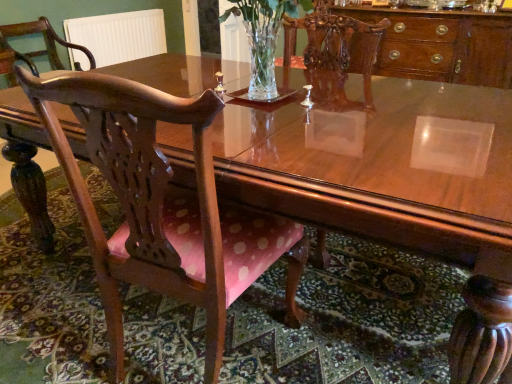
This screenshot has width=512, height=384. I want to click on wooden chair with pink cushion at center, which is the first chair from bottom to top, so click(162, 206).

This screenshot has height=384, width=512. What do you see at coordinates (41, 50) in the screenshot?
I see `polished wood chair at left, positioned as the first chair in top-to-bottom order` at bounding box center [41, 50].

In order to face polished wood cabinet at upper right, should I rotate leftwards or rightwards?

To face it directly, rotate right by 21.017 degrees.

The height and width of the screenshot is (384, 512). Find the location of `wooden chair with pink cushion at center, which is the second chair from left to right`. wooden chair with pink cushion at center, which is the second chair from left to right is located at coordinates (162, 206).

Which of these two, white ribbed radiator at upper left or clear glass vase at center, stands shorter?

Standing shorter between the two is clear glass vase at center.

Can we say white ribbed radiator at upper left lies outside clear glass vase at center?

Yes.

Can you tell me how much white ribbed radiator at upper left and clear glass vase at center differ in facing direction?

The facing directions of white ribbed radiator at upper left and clear glass vase at center are 87.4 degrees apart.

Is white ribbed radiator at upper left not near clear glass vase at center?

That's right, there is a large distance between white ribbed radiator at upper left and clear glass vase at center.

From the picture: Can you see polished wood cabinet at upper right touching wooden chair with pink cushion at center, which is counted as the second chair, starting from the back?

No.

From a real-world perspective, which is physically above, polished wood cabinet at upper right or wooden chair with pink cushion at center, which ranks as the first chair in right-to-left order?

polished wood cabinet at upper right.

Relative to wooden chair with pink cushion at center, acting as the 2th chair starting from the top, is polished wood cabinet at upper right in front or behind?

Visually, polished wood cabinet at upper right is located behind wooden chair with pink cushion at center, acting as the 2th chair starting from the top.

Would you say polished wood cabinet at upper right contains wooden chair with pink cushion at center, which ranks as the first chair in right-to-left order?

No, wooden chair with pink cushion at center, which ranks as the first chair in right-to-left order, is not surrounded by polished wood cabinet at upper right.

From a real-world perspective, is polished wood chair at left, arranged as the 2th chair when viewed from the front, located beneath white ribbed radiator at upper left?

No, from a real-world perspective, polished wood chair at left, arranged as the 2th chair when viewed from the front, is not below white ribbed radiator at upper left.

Is polished wood chair at left, which is the 1th chair in left-to-right order, taller or shorter than white ribbed radiator at upper left?

polished wood chair at left, which is the 1th chair in left-to-right order, is taller than white ribbed radiator at upper left.

Considering the positions of objects polished wood chair at left, arranged as the 2th chair when viewed from the front, and white ribbed radiator at upper left in the image provided, who is more to the left, polished wood chair at left, arranged as the 2th chair when viewed from the front, or white ribbed radiator at upper left?

Positioned to the left is polished wood chair at left, arranged as the 2th chair when viewed from the front.

Does point (274, 99) appear closer or farther from the camera than point (7, 30)?

Point (274, 99) is closer to the camera than point (7, 30).

Can you confirm if clear glass vase at center is taller than polished wood chair at left, acting as the first chair starting from the back?

No, clear glass vase at center is not taller than polished wood chair at left, acting as the first chair starting from the back.

Looking at the image, does clear glass vase at center seem bigger or smaller compared to polished wood chair at left, arranged as the 2th chair when viewed from the front?

Considering their sizes, clear glass vase at center takes up less space than polished wood chair at left, arranged as the 2th chair when viewed from the front.

Is clear glass vase at center outside of polished wood chair at left, positioned as the first chair in top-to-bottom order?

Yes, clear glass vase at center is outside of polished wood chair at left, positioned as the first chair in top-to-bottom order.

From a real-world perspective, between wooden chair with pink cushion at center, which is counted as the second chair, starting from the back, and polished wood cabinet at upper right, who is vertically lower?

From a 3D spatial view, wooden chair with pink cushion at center, which is counted as the second chair, starting from the back, is below.

Is polished wood cabinet at upper right located within wooden chair with pink cushion at center, acting as the first chair starting from the front?

No.

Where is `cabinetry above the wooden chair with pink cushion at center, which is the second chair from left to right (from a real-world perspective)`? cabinetry above the wooden chair with pink cushion at center, which is the second chair from left to right (from a real-world perspective) is located at coordinates (442, 45).

Considering their positions, is wooden chair with pink cushion at center, acting as the first chair starting from the front, located in front of or behind polished wood cabinet at upper right?

Visually, wooden chair with pink cushion at center, acting as the first chair starting from the front, is located in front of polished wood cabinet at upper right.

From the image's perspective, which one is positioned higher, white ribbed radiator at upper left or polished wood chair at left, the second chair in the bottom-to-top sequence?

white ribbed radiator at upper left, from the image's perspective.

Is white ribbed radiator at upper left situated inside polished wood chair at left, acting as the first chair starting from the back, or outside?

white ribbed radiator at upper left exists outside the volume of polished wood chair at left, acting as the first chair starting from the back.

From a real-world perspective, which is physically above, white ribbed radiator at upper left or polished wood chair at left, the second chair in the bottom-to-top sequence?

polished wood chair at left, the second chair in the bottom-to-top sequence, is physically above.

Is white ribbed radiator at upper left thinner than polished wood chair at left, arranged as the 2th chair when viewed from the front?

Yes.

Is clear glass vase at center a part of polished wood cabinet at upper right?

No, clear glass vase at center is not inside polished wood cabinet at upper right.

Is polished wood cabinet at upper right positioned in front of clear glass vase at center?

No, it is not.

Does polished wood cabinet at upper right have a greater width compared to clear glass vase at center?

Yes, polished wood cabinet at upper right is wider than clear glass vase at center.

Who is shorter, polished wood cabinet at upper right or clear glass vase at center?

clear glass vase at center.

You are a GUI agent. You are given a task and a screenshot of the screen. Output one action in this format:
    pyautogui.click(x=<x>, y=<y>)
    Task: Click on the radiator on the left side of clear glass vase at center
    The height and width of the screenshot is (384, 512).
    Given the screenshot: What is the action you would take?
    pyautogui.click(x=119, y=35)

I want to click on cabinetry behind the wooden chair with pink cushion at center, which ranks as the first chair in right-to-left order, so click(x=442, y=45).

Looking at the image, which one is located closer to clear glass vase at center, wooden chair with pink cushion at center, which is the first chair from bottom to top, or white ribbed radiator at upper left?

wooden chair with pink cushion at center, which is the first chair from bottom to top.

Looking at the image, which one is located further to polished wood cabinet at upper right, polished wood chair at left, which ranks as the 2th chair in right-to-left order, or wooden chair with pink cushion at center, which is counted as the second chair, starting from the back?

Among the two, polished wood chair at left, which ranks as the 2th chair in right-to-left order, is located further to polished wood cabinet at upper right.

When comparing their distances from wooden chair with pink cushion at center, which is the first chair from bottom to top, does clear glass vase at center or polished wood chair at left, acting as the first chair starting from the back, seem closer?

The object closer to wooden chair with pink cushion at center, which is the first chair from bottom to top, is clear glass vase at center.

Looking at the image, which one is located further to clear glass vase at center, polished wood chair at left, arranged as the 2th chair when viewed from the front, or polished wood cabinet at upper right?

polished wood chair at left, arranged as the 2th chair when viewed from the front.

Considering their positions, is clear glass vase at center positioned further to polished wood cabinet at upper right than white ribbed radiator at upper left?

Among the two, white ribbed radiator at upper left is located further to polished wood cabinet at upper right.

Considering their positions, is polished wood cabinet at upper right positioned closer to white ribbed radiator at upper left than wooden chair with pink cushion at center, acting as the 2th chair starting from the top?

polished wood cabinet at upper right is positioned closer to the anchor white ribbed radiator at upper left.

In the scene shown: When comparing their distances from polished wood cabinet at upper right, does polished wood chair at left, which is the 1th chair in left-to-right order, or white ribbed radiator at upper left seem closer?

Among the two, polished wood chair at left, which is the 1th chair in left-to-right order, is located nearer to polished wood cabinet at upper right.

Estimate the real-world distances between objects in this image. Which object is further from wooden chair with pink cushion at center, which is counted as the second chair, starting from the back, white ribbed radiator at upper left or polished wood chair at left, acting as the first chair starting from the back?

white ribbed radiator at upper left lies further to wooden chair with pink cushion at center, which is counted as the second chair, starting from the back, than the other object.

What are the coordinates of `floral arrangement between white ribbed radiator at upper left and polished wood cabinet at upper right from left to right` in the screenshot? It's located at (264, 39).

Find the location of `cabinetry between wooden chair with pink cushion at center, acting as the first chair starting from the front, and white ribbed radiator at upper left from front to back`. cabinetry between wooden chair with pink cushion at center, acting as the first chair starting from the front, and white ribbed radiator at upper left from front to back is located at coordinates (442, 45).

I want to click on radiator between polished wood chair at left, positioned as the first chair in top-to-bottom order, and polished wood cabinet at upper right from left to right, so click(119, 35).

You are a GUI agent. You are given a task and a screenshot of the screen. Output one action in this format:
    pyautogui.click(x=<x>, y=<y>)
    Task: Click on the chair between wooden chair with pink cushion at center, which is the first chair from bottom to top, and white ribbed radiator at upper left in the front-back direction
    
    Given the screenshot: What is the action you would take?
    pyautogui.click(x=41, y=50)